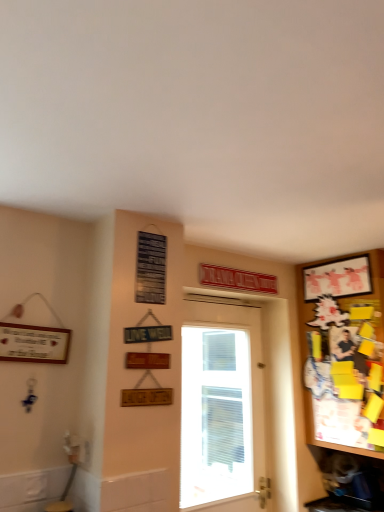
Measure the distance between white glossy door at center and camera.

white glossy door at center and camera are 12.15 feet apart from each other.

What do you see at coordinates (344, 352) in the screenshot? I see `wooden bulletin board at right` at bounding box center [344, 352].

Describe the element at coordinates (338, 278) in the screenshot. I see `matte white picture frame at upper right` at that location.

The image size is (384, 512). What are the coordinates of `white glossy door at center` in the screenshot? It's located at (220, 402).

Considering the relative positions of white glossy door at center and wooden bulletin board at right in the image provided, is white glossy door at center to the right of wooden bulletin board at right from the viewer's perspective?

Incorrect, white glossy door at center is not on the right side of wooden bulletin board at right.

Which is more distant, (185, 305) or (324, 314)?

The point (324, 314) is more distant.

Does white glossy door at center have a larger size compared to wooden bulletin board at right?

Actually, white glossy door at center might be smaller than wooden bulletin board at right.

How many degrees apart are the facing directions of white glossy door at center and wooden bulletin board at right?

The angle between the facing direction of white glossy door at center and the facing direction of wooden bulletin board at right is 0.48 degrees.

Could you tell me if matte white picture frame at upper right is turned towards white glossy door at center?

No, matte white picture frame at upper right is not facing towards white glossy door at center.

Is point (327, 267) less distant than point (198, 494)?

No, (327, 267) is further to viewer.

Locate an element on the screen. door that appears below the matte white picture frame at upper right (from a real-world perspective) is located at coordinates (220, 402).

Considering the sizes of objects wooden bulletin board at right and white glossy door at center in the image provided, who is wider, wooden bulletin board at right or white glossy door at center?

With larger width is wooden bulletin board at right.

Is wooden bulletin board at right further to camera compared to white glossy door at center?

No, wooden bulletin board at right is closer to the viewer.

Based on the photo, from a real-world perspective, is wooden bulletin board at right positioned above or below white glossy door at center?

Clearly, from a real-world perspective, wooden bulletin board at right is above white glossy door at center.

Between point (371, 374) and point (200, 401), which one is positioned behind?

The point (200, 401) is farther.

Is wooden bulletin board at right turned away from matte white picture frame at upper right?

wooden bulletin board at right does not have its back to matte white picture frame at upper right.

In the image, is wooden bulletin board at right on the left side or the right side of matte white picture frame at upper right?

In the image, wooden bulletin board at right appears on the right side of matte white picture frame at upper right.

From a real-world perspective, who is located lower, wooden bulletin board at right or matte white picture frame at upper right?

wooden bulletin board at right is physically lower.

From the image's perspective, is white glossy door at center positioned above or below matte white picture frame at upper right?

Clearly, from the image's perspective, white glossy door at center is below matte white picture frame at upper right.

Consider the image. Is white glossy door at center outside of matte white picture frame at upper right?

Absolutely, white glossy door at center is external to matte white picture frame at upper right.

Is white glossy door at center to the left of matte white picture frame at upper right from the viewer's perspective?

Yes.

Between matte white picture frame at upper right and wooden bulletin board at right, which one has more height?

wooden bulletin board at right.

Considering the positions of objects matte white picture frame at upper right and wooden bulletin board at right in the image provided, who is more to the right, matte white picture frame at upper right or wooden bulletin board at right?

wooden bulletin board at right is more to the right.

Based on the photo, could you tell me if matte white picture frame at upper right is turned towards wooden bulletin board at right?

No, matte white picture frame at upper right is not turned towards wooden bulletin board at right.

Is matte white picture frame at upper right with wooden bulletin board at right?

No, matte white picture frame at upper right is not next to wooden bulletin board at right.

Locate an element on the screen. cabinetry in front of the white glossy door at center is located at coordinates (344, 352).

Find the location of `picture frame above the white glossy door at center (from the image's perspective)`. picture frame above the white glossy door at center (from the image's perspective) is located at coordinates (338, 278).

Estimate the real-world distances between objects in this image. Which object is further from white glossy door at center, wooden bulletin board at right or matte white picture frame at upper right?

Based on the image, matte white picture frame at upper right appears to be further to white glossy door at center.

Based on the photo, which object lies further to the anchor point wooden bulletin board at right, white glossy door at center or matte white picture frame at upper right?

white glossy door at center lies further to wooden bulletin board at right than the other object.

From the image, which object appears to be nearer to matte white picture frame at upper right, wooden bulletin board at right or white glossy door at center?

wooden bulletin board at right lies closer to matte white picture frame at upper right than the other object.

Which object lies further to the anchor point white glossy door at center, matte white picture frame at upper right or wooden bulletin board at right?

matte white picture frame at upper right is further to white glossy door at center.

Estimate the real-world distances between objects in this image. Which object is closer to matte white picture frame at upper right, white glossy door at center or wooden bulletin board at right?

wooden bulletin board at right.

Estimate the real-world distances between objects in this image. Which object is closer to wooden bulletin board at right, matte white picture frame at upper right or white glossy door at center?

The object closer to wooden bulletin board at right is matte white picture frame at upper right.

Where is `picture frame situated between white glossy door at center and wooden bulletin board at right from left to right`? The image size is (384, 512). picture frame situated between white glossy door at center and wooden bulletin board at right from left to right is located at coordinates (338, 278).